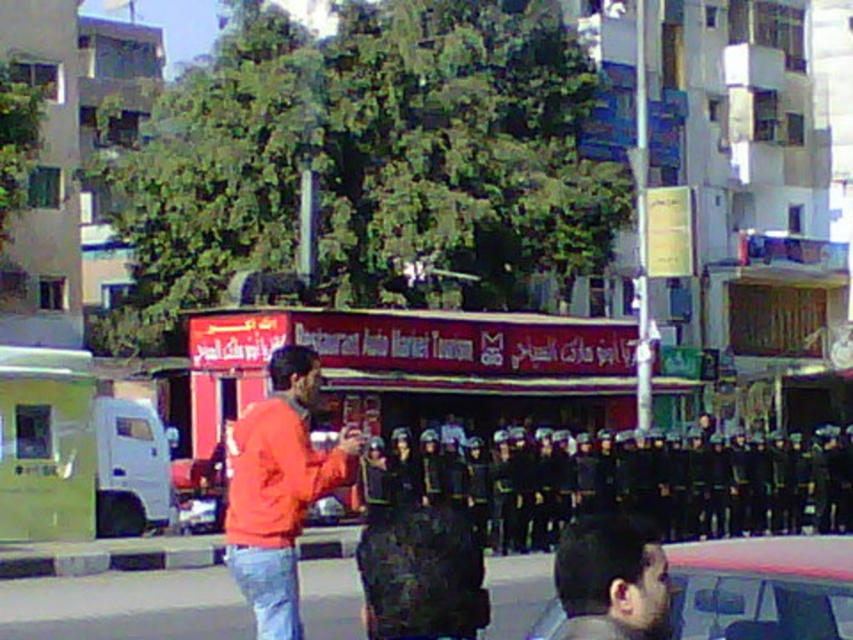
Which is in front, point (486, 388) or point (622, 548)?

Point (622, 548) is more forward.

Is red matte food truck at center to the right of smooth black hair at lower right from the viewer's perspective?

No, red matte food truck at center is not to the right of smooth black hair at lower right.

Who is more distant from viewer, [602,380] or [560,564]?

Positioned behind is point [602,380].

Where is `red matte food truck at center`? red matte food truck at center is located at coordinates (418, 368).

Which of these two, red matte food truck at center or metallic silver car at lower right, stands taller?

With more height is red matte food truck at center.

The height and width of the screenshot is (640, 853). What are the coordinates of `red matte food truck at center` in the screenshot? It's located at (418, 368).

Can you confirm if orange matte jacket at center is smaller than smooth black hair at lower right?

Actually, orange matte jacket at center might be larger than smooth black hair at lower right.

The height and width of the screenshot is (640, 853). What do you see at coordinates (277, 488) in the screenshot? I see `orange matte jacket at center` at bounding box center [277, 488].

At what (x,y) coordinates should I click in order to perform the action: click on orange matte jacket at center. Please return your answer as a coordinate pair (x, y). Image resolution: width=853 pixels, height=640 pixels. Looking at the image, I should click on (277, 488).